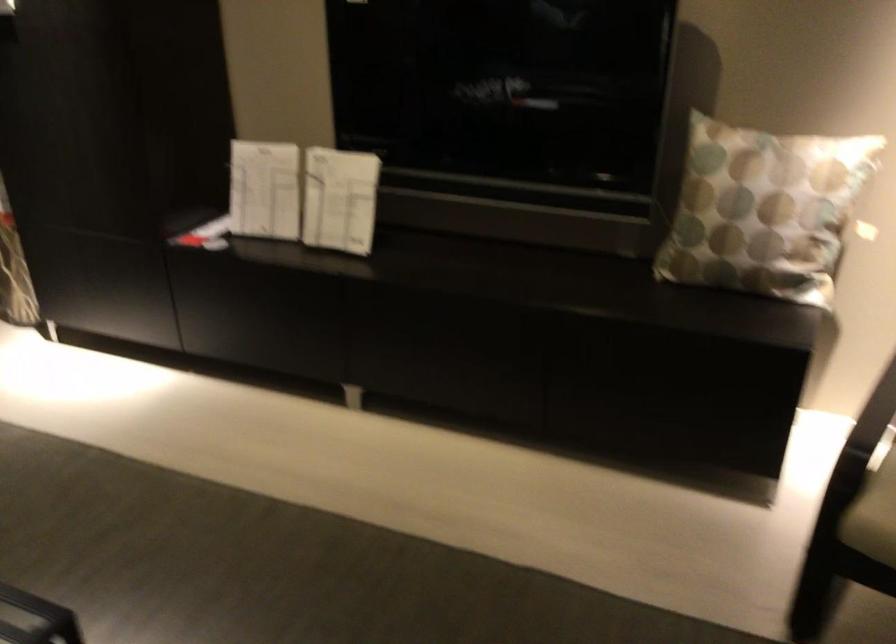
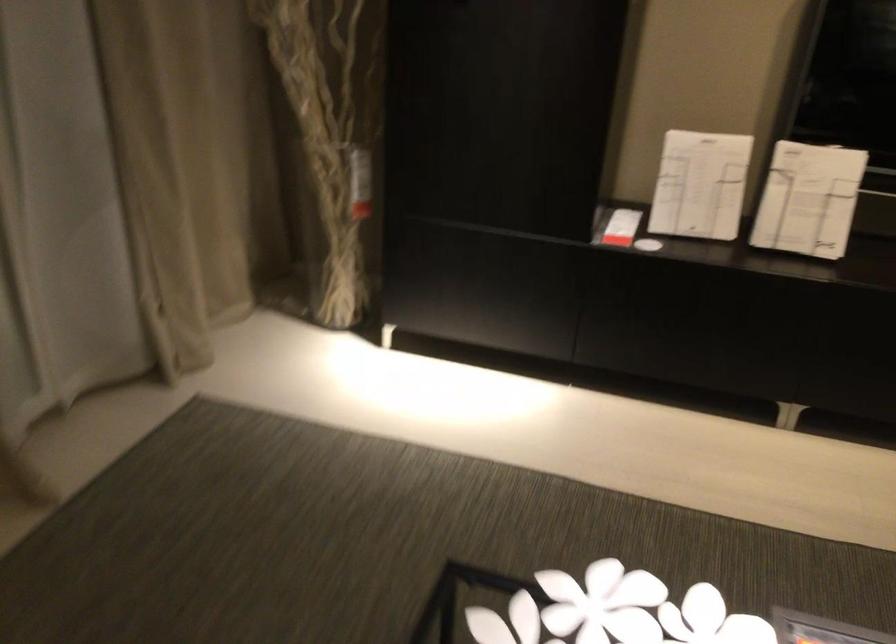
Locate, in the second image, the point that corresponds to [337,204] in the first image.

(808, 200)